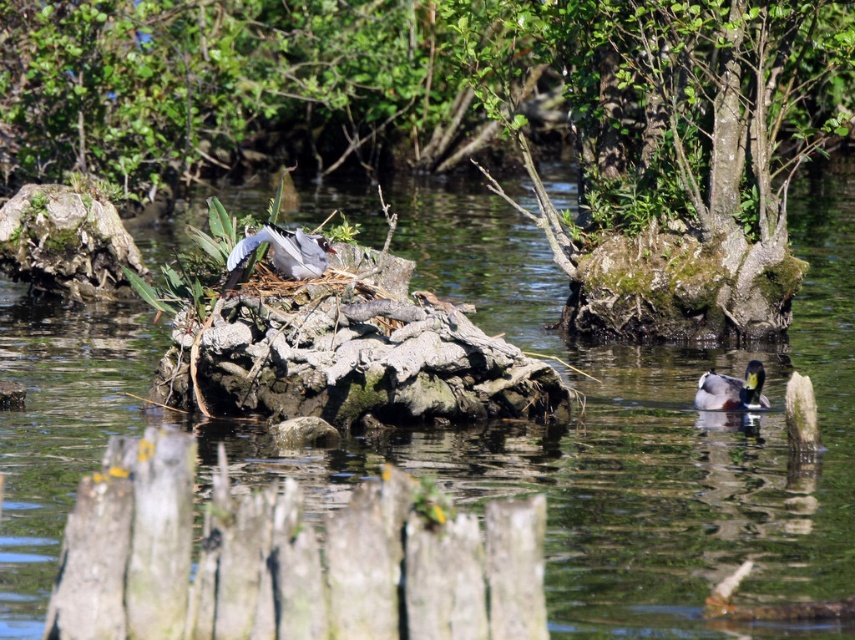
Question: Does green mossy tree at upper center have a smaller size compared to white feathered bird at center?

Choices:
 (A) no
 (B) yes

Answer: (A)

Question: Estimate the real-world distances between objects in this image. Which object is farther from the green glossy duck at lower right?

Choices:
 (A) white feathered bird at center
 (B) green mossy rock at center
 (C) green mossy tree at upper center

Answer: (B)

Question: Does green mossy rock at center have a lesser width compared to green glossy duck at lower right?

Choices:
 (A) yes
 (B) no

Answer: (B)

Question: Considering the relative positions of green mossy tree at upper center and white feathered bird at center in the image provided, where is green mossy tree at upper center located with respect to white feathered bird at center?

Choices:
 (A) below
 (B) above

Answer: (B)

Question: Which point is closer to the camera taking this photo?

Choices:
 (A) click(653, 58)
 (B) click(749, 381)
 (C) click(40, 76)

Answer: (B)

Question: Among these points, which one is nearest to the camera?

Choices:
 (A) (770, 172)
 (B) (92, 138)
 (C) (761, 378)

Answer: (C)